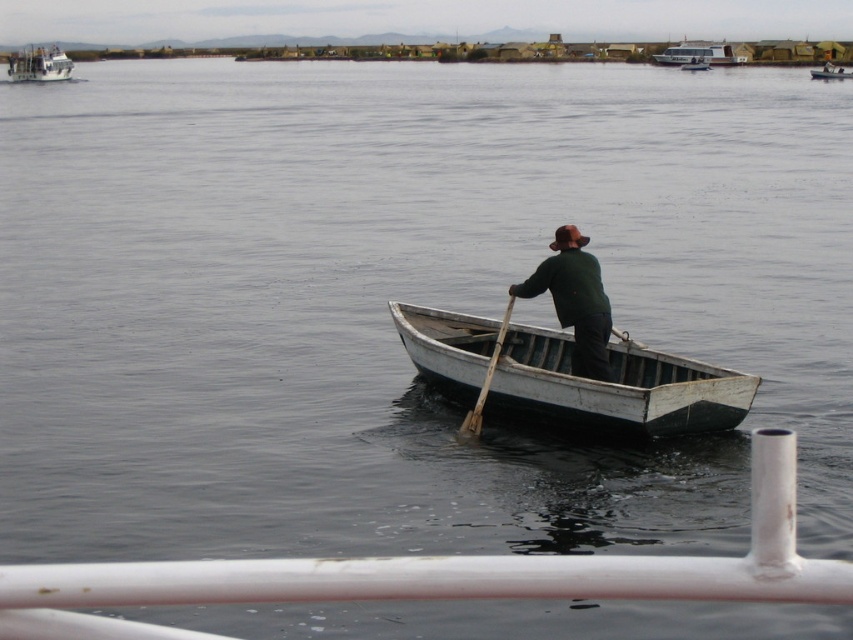
Question: From the image, what is the correct spatial relationship of green matte jacket at center in relation to white wooden boat at upper left?

Choices:
 (A) below
 (B) above

Answer: (A)

Question: Estimate the real-world distances between objects in this image. Which object is closer to the white wooden boat at upper left?

Choices:
 (A) white wooden canoe at center
 (B) wooden boat at center

Answer: (B)

Question: Estimate the real-world distances between objects in this image. Which object is closer to the green matte jacket at center?

Choices:
 (A) wooden boat at center
 (B) white wooden boat at upper right

Answer: (A)

Question: Estimate the real-world distances between objects in this image. Which object is closer to the green matte jacket at center?

Choices:
 (A) wooden at center
 (B) wooden boat at center
 (C) white wooden boat at upper right
 (D) white wooden boat at upper left

Answer: (A)

Question: Can you confirm if wooden at center is smaller than wooden boat at center?

Choices:
 (A) yes
 (B) no

Answer: (A)

Question: Does white wooden canoe at center come behind white wooden boat at upper left?

Choices:
 (A) no
 (B) yes

Answer: (A)